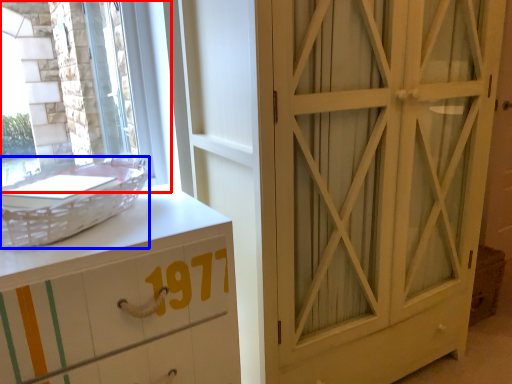
Question: Among these objects, which one is nearest to the camera, window (highlighted by a red box) or basket (highlighted by a blue box)?

Choices:
 (A) window
 (B) basket

Answer: (B)